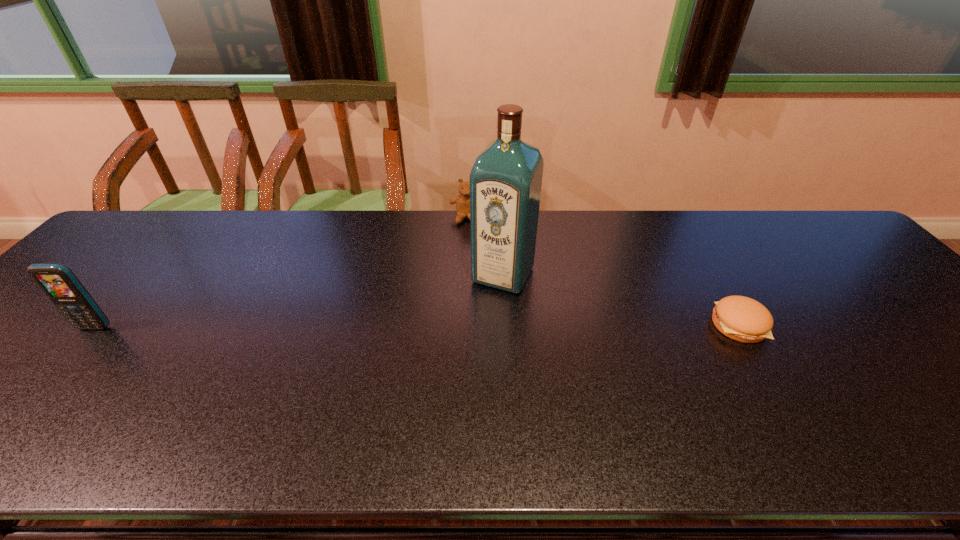
Where is `free spot on the desktop that is between the second tallest object and the rightmost object and is positioned on the flat label side of the second farthest object`? The height and width of the screenshot is (540, 960). free spot on the desktop that is between the second tallest object and the rightmost object and is positioned on the flat label side of the second farthest object is located at coordinates (475, 326).

I want to click on free space on the desktop that is between the second tallest object and the shortest object and is positioned on the face of the second shortest object, so click(x=462, y=326).